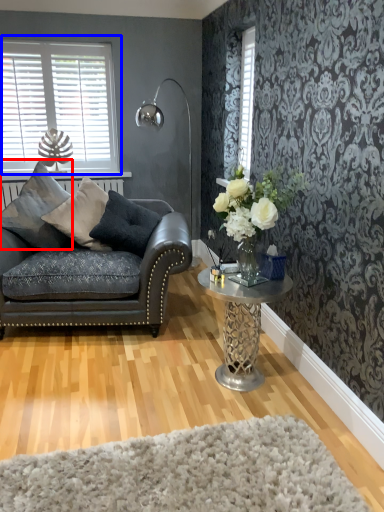
Question: Which point is closer to the camera, pillow (highlighted by a red box) or window (highlighted by a blue box)?

Choices:
 (A) pillow
 (B) window

Answer: (A)